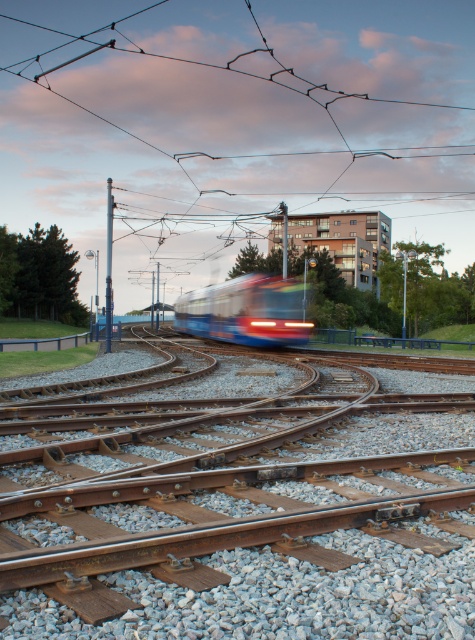
Question: Is brown wooden track at center wider than blue glossy tram at center?

Choices:
 (A) yes
 (B) no

Answer: (B)

Question: Which point appears closest to the camera in this image?

Choices:
 (A) (197, 582)
 (B) (263, 310)

Answer: (A)

Question: Which of the following is the farthest from the observer?

Choices:
 (A) blue glossy tram at center
 (B) brown wooden track at center

Answer: (A)

Question: Considering the relative positions of brown wooden track at center and blue glossy tram at center in the image provided, where is brown wooden track at center located with respect to blue glossy tram at center?

Choices:
 (A) above
 (B) below

Answer: (B)

Question: Does brown wooden track at center have a smaller size compared to blue glossy tram at center?

Choices:
 (A) yes
 (B) no

Answer: (A)